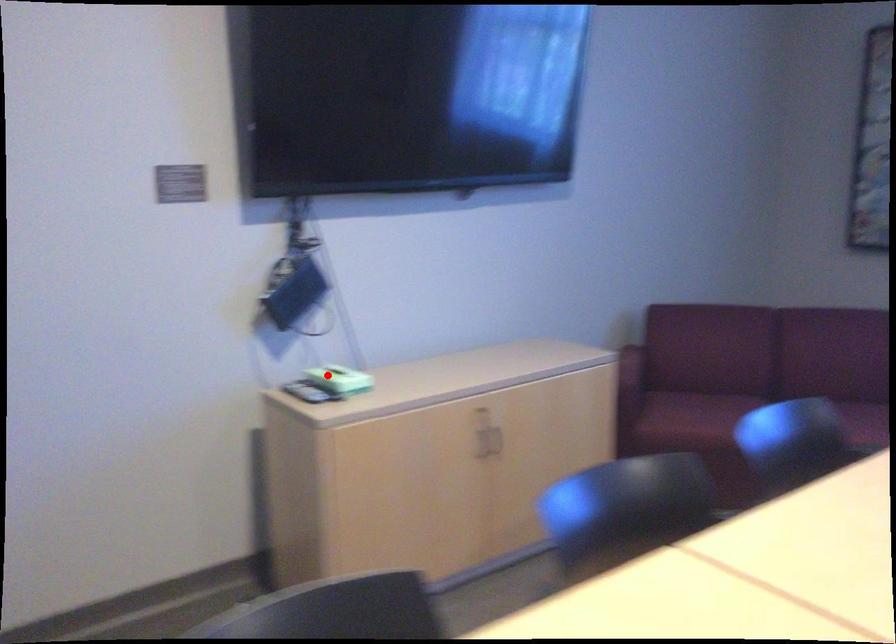
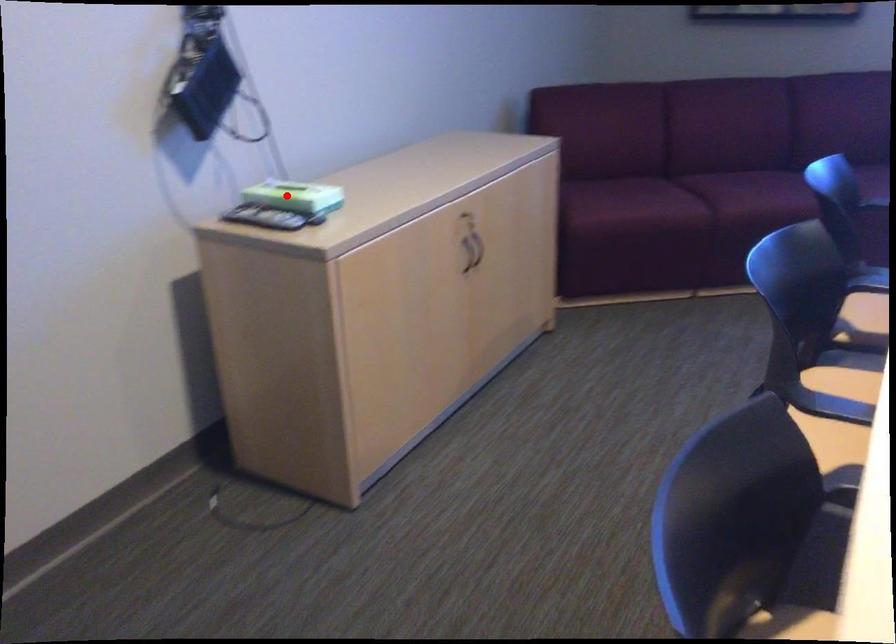
I am providing you with two images of the same scene from different viewpoints. A red point is marked on the first image and another point is marked on the second image. Is the marked point in image1 the same physical position as the marked point in image2?

Yes